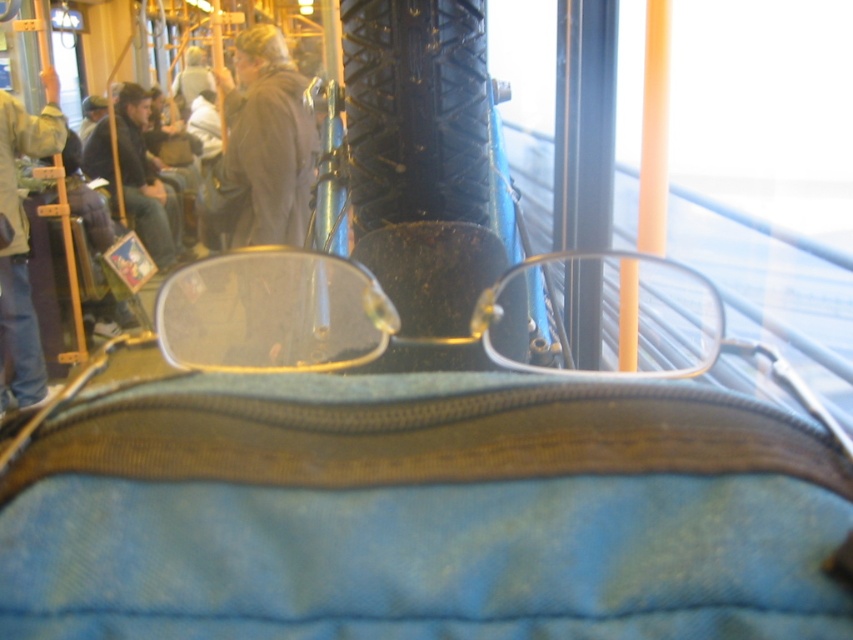
Does clear plastic glasses at center have a greater height compared to denim jacket at left?

Incorrect, clear plastic glasses at center's height is not larger of denim jacket at left's.

Is clear plastic glasses at center closer to the viewer compared to denim jacket at left?

Yes.

Who is more forward, (389, 291) or (3, 374)?

Positioned in front is point (389, 291).

Where is `clear plastic glasses at center`? This screenshot has height=640, width=853. clear plastic glasses at center is located at coordinates (422, 337).

Does point (306, 220) lie in front of point (140, 96)?

Yes, point (306, 220) is closer to viewer.

Measure the distance from dark gray jacket at center to dark blue jeans at left.

dark gray jacket at center and dark blue jeans at left are 4.54 feet apart from each other.

What do you see at coordinates (267, 140) in the screenshot? This screenshot has width=853, height=640. I see `dark gray jacket at center` at bounding box center [267, 140].

Where is `dark gray jacket at center`? dark gray jacket at center is located at coordinates (267, 140).

Is point (827, 492) farther from camera compared to point (457, 129)?

No, (827, 492) is closer to viewer.

Is blue fabric bag at center taller than black rubber tire at center?

No, blue fabric bag at center is not taller than black rubber tire at center.

Describe the element at coordinates (412, 477) in the screenshot. Image resolution: width=853 pixels, height=640 pixels. I see `blue fabric bag at center` at that location.

At what (x,y) coordinates should I click in order to perform the action: click on blue fabric bag at center. Please return your answer as a coordinate pair (x, y). Image resolution: width=853 pixels, height=640 pixels. Looking at the image, I should click on (412, 477).